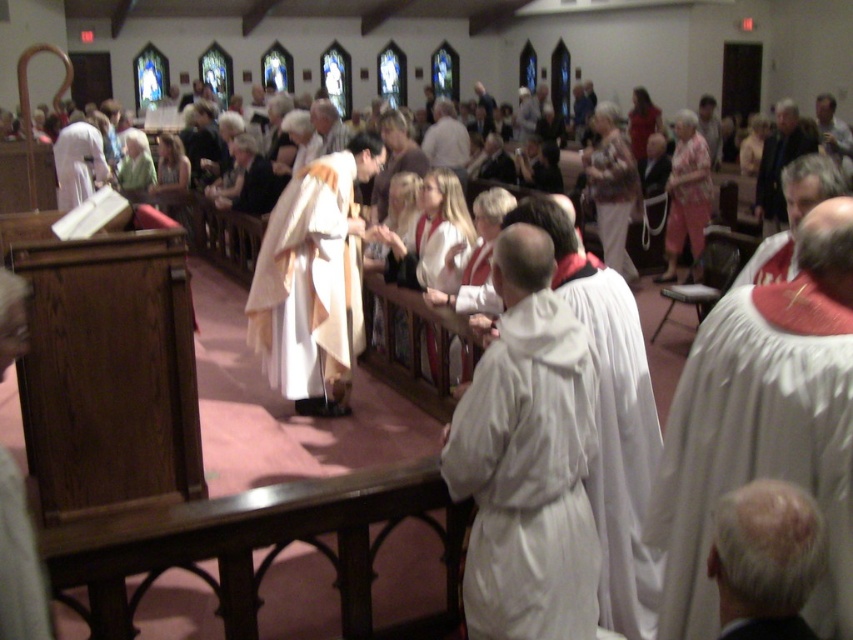
This screenshot has width=853, height=640. Describe the element at coordinates (527, 477) in the screenshot. I see `white cloth robe at center` at that location.

Which is more to the right, white cloth robe at center or gray hair at upper right?

gray hair at upper right is more to the right.

Image resolution: width=853 pixels, height=640 pixels. I want to click on white cloth robe at center, so click(527, 477).

Does white clothed robe at center have a lesser height compared to white matte robe at left?

No, white clothed robe at center is not shorter than white matte robe at left.

Identify the location of white clothed robe at center. Image resolution: width=853 pixels, height=640 pixels. (763, 424).

Describe the element at coordinates (763, 424) in the screenshot. I see `white clothed robe at center` at that location.

Where is `white clothed robe at center`? white clothed robe at center is located at coordinates (763, 424).

Is point (57, 154) closer to viewer compared to point (834, 132)?

Yes, point (57, 154) is in front of point (834, 132).

Between point (99, 164) and point (831, 150), which one is positioned behind?

Point (99, 164)

This screenshot has height=640, width=853. I want to click on white matte robe at left, so click(x=78, y=163).